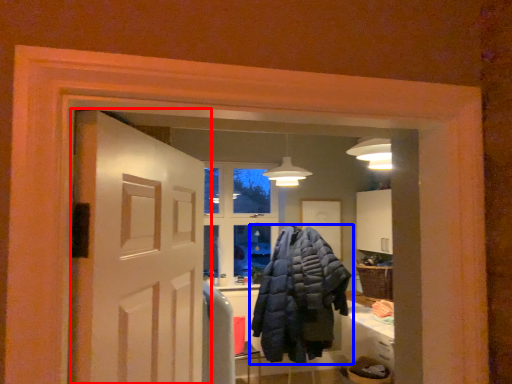
Question: Which of the following is the closest to the observer, door (highlighted by a red box) or jacket (highlighted by a blue box)?

Choices:
 (A) door
 (B) jacket

Answer: (A)